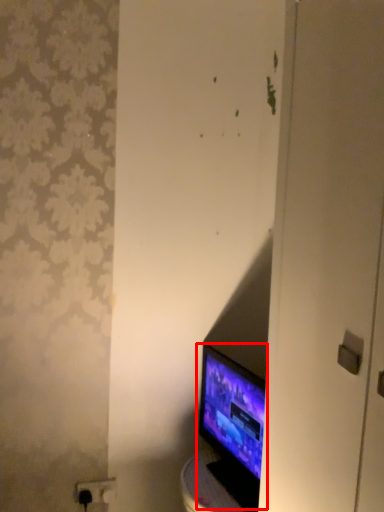
Question: Observing the image, what is the correct spatial positioning of computer monitor (annotated by the red box) in reference to electric outlet?

Choices:
 (A) right
 (B) left

Answer: (A)